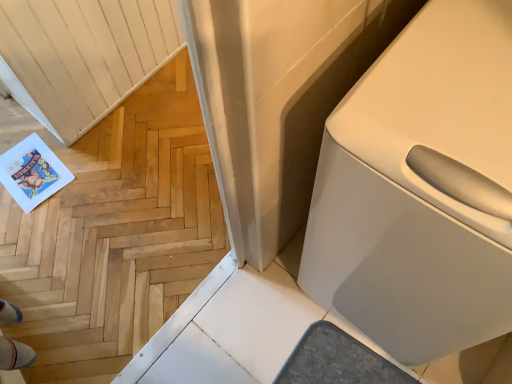
Question: Could you tell me if white glossy toilet at right is turned towards natural wood floor at lower left?

Choices:
 (A) yes
 (B) no

Answer: (B)

Question: From a real-world perspective, is white glossy toilet at right positioned under natural wood floor at lower left based on gravity?

Choices:
 (A) no
 (B) yes

Answer: (B)

Question: Considering the relative sizes of white glossy toilet at right and natural wood floor at lower left in the image provided, is white glossy toilet at right taller than natural wood floor at lower left?

Choices:
 (A) yes
 (B) no

Answer: (B)

Question: Is white glossy toilet at right touching natural wood floor at lower left?

Choices:
 (A) no
 (B) yes

Answer: (A)

Question: Is white glossy toilet at right surrounding natural wood floor at lower left?

Choices:
 (A) yes
 (B) no

Answer: (B)

Question: Is natural wood floor at lower left at the back of white glossy toilet at right?

Choices:
 (A) no
 (B) yes

Answer: (A)

Question: From the image's perspective, is natural wood floor at lower left located beneath white glossy toilet at right?

Choices:
 (A) no
 (B) yes

Answer: (B)

Question: From a real-world perspective, is natural wood floor at lower left over white glossy toilet at right?

Choices:
 (A) yes
 (B) no

Answer: (A)

Question: Can you confirm if natural wood floor at lower left is bigger than white glossy toilet at right?

Choices:
 (A) yes
 (B) no

Answer: (B)

Question: Is natural wood floor at lower left behind white glossy toilet at right?

Choices:
 (A) no
 (B) yes

Answer: (A)

Question: Would you consider natural wood floor at lower left to be distant from white glossy toilet at right?

Choices:
 (A) no
 (B) yes

Answer: (A)

Question: Could you tell me if natural wood floor at lower left is turned towards white glossy toilet at right?

Choices:
 (A) no
 (B) yes

Answer: (A)

Question: In terms of width, does white glossy toilet at right look wider or thinner when compared to natural wood floor at lower left?

Choices:
 (A) wide
 (B) thin

Answer: (A)